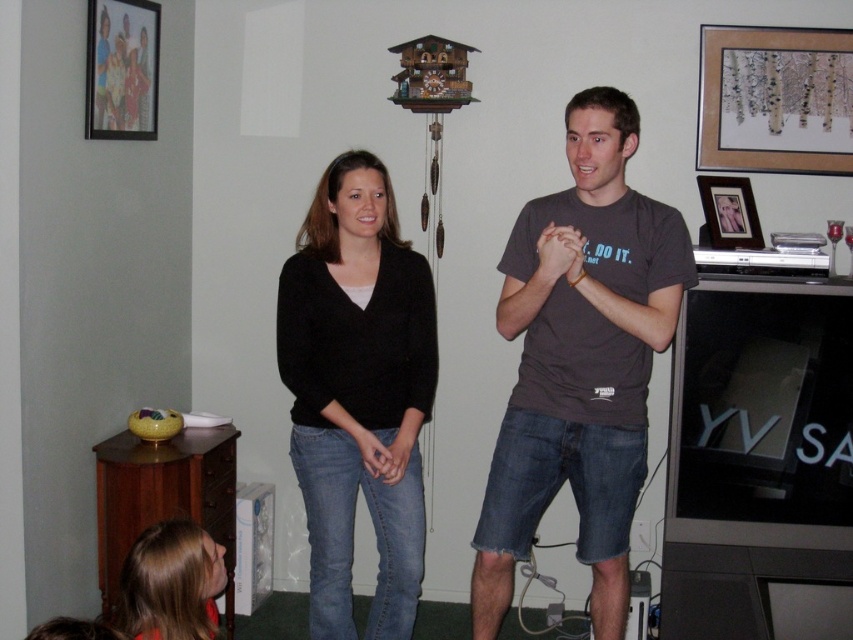
Does point (390, 428) come in front of point (181, 602)?

No, (390, 428) is behind (181, 602).

Between black sweater at center and blonde hair at lower left, which one has less height?

blonde hair at lower left is shorter.

Is point (375, 632) farther from viewer compared to point (154, 600)?

Yes, point (375, 632) is farther from viewer.

Find the location of a particular element. The height and width of the screenshot is (640, 853). black sweater at center is located at coordinates (358, 392).

Between point (357, 429) and point (141, 20), which one is positioned behind?

The point (141, 20) is behind.

Is black sweater at center shorter than wooden picture frame at upper left?

No, black sweater at center is not shorter than wooden picture frame at upper left.

Where is `black sweater at center`? The image size is (853, 640). black sweater at center is located at coordinates 358,392.

Find the location of a particular element. The height and width of the screenshot is (640, 853). black sweater at center is located at coordinates (358, 392).

Does dark gray t-shirt at center have a lesser height compared to matte black picture frame at upper right?

In fact, dark gray t-shirt at center may be taller than matte black picture frame at upper right.

Between dark gray t-shirt at center and matte black picture frame at upper right, which one has less height?

With less height is matte black picture frame at upper right.

Which is in front, point (689, 266) or point (755, 221)?

Point (689, 266) is more forward.

Identify the location of dark gray t-shirt at center. The image size is (853, 640). (579, 360).